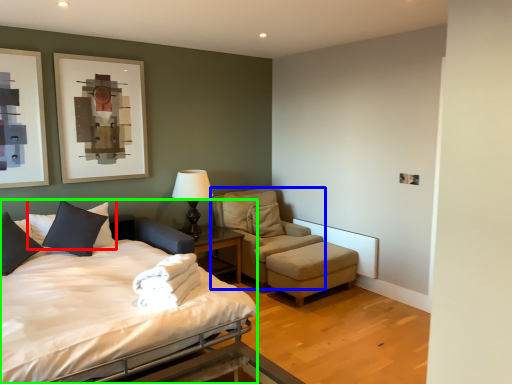
Question: Estimate the real-world distances between objects in this image. Which object is closer to pillow (highlighted by a red box), chair (highlighted by a blue box) or bed (highlighted by a green box)?

Choices:
 (A) chair
 (B) bed

Answer: (B)